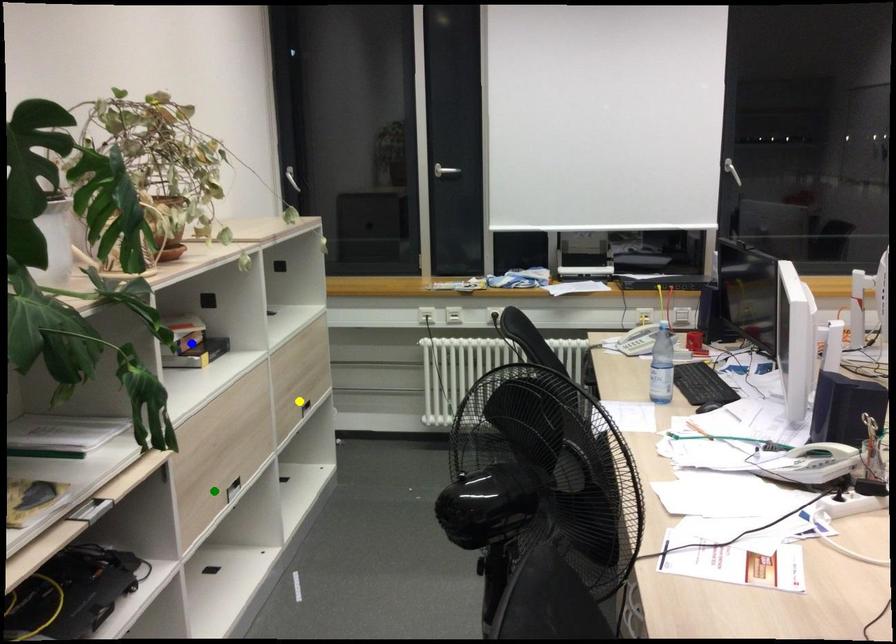
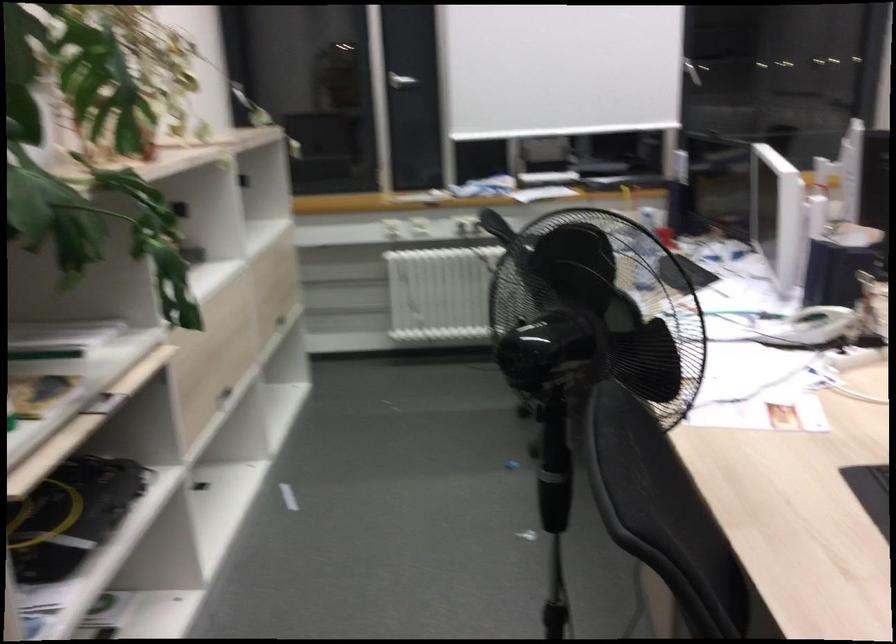
I am providing you with two images of the same scene from different viewpoints. Three points are marked in image1. Which point corresponds to a part or object that is occluded in image2?In image1, three points are marked. Which of them correspond to a part or object that is occluded in image2?Among the three points shown in image1, which one corresponds to a part or object that is no longer visible due to occlusion in image2?

blue point